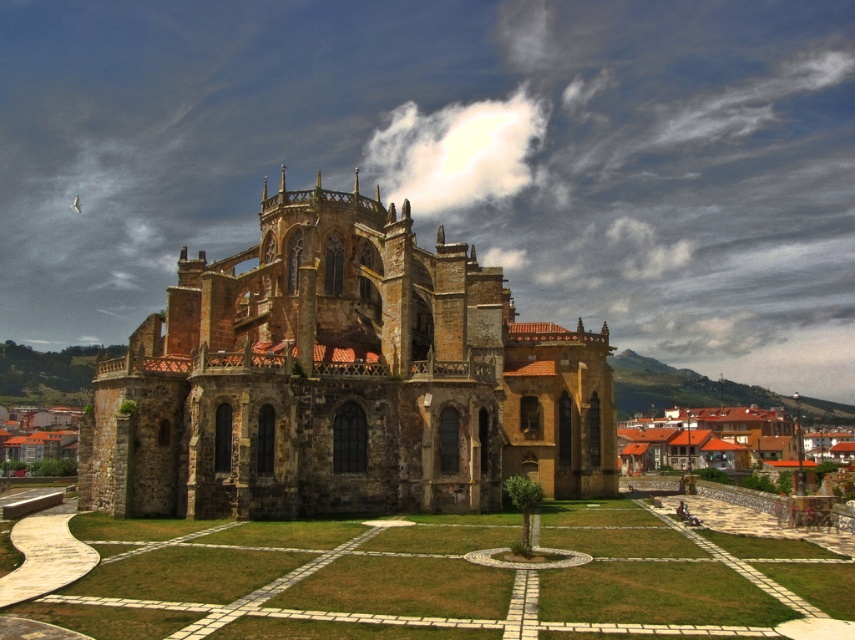
Question: Which is farther from the brown wooden houses at lower right?

Choices:
 (A) brown stone church at center
 (B) brown stone buildings at lower left

Answer: (B)

Question: From the image, what is the correct spatial relationship of brown stone church at center in relation to brown stone buildings at lower left?

Choices:
 (A) above
 (B) below

Answer: (A)

Question: Can you confirm if brown wooden houses at lower right is wider than brown stone buildings at lower left?

Choices:
 (A) no
 (B) yes

Answer: (B)

Question: Which object is positioned closest to the brown wooden houses at lower right?

Choices:
 (A) brown stone buildings at lower left
 (B) brown stone church at center

Answer: (B)

Question: Which is farther from the brown stone church at center?

Choices:
 (A) brown stone buildings at lower left
 (B) brown wooden houses at lower right

Answer: (A)

Question: Does brown wooden houses at lower right have a larger size compared to brown stone buildings at lower left?

Choices:
 (A) yes
 (B) no

Answer: (A)